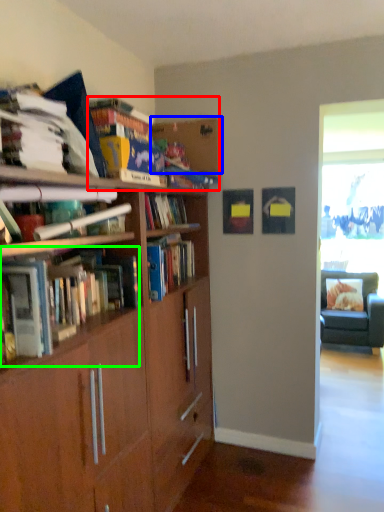
Question: Considering the real-world distances, which object is farthest from book (highlighted by a red box)? shelf (highlighted by a blue box) or book (highlighted by a green box)?

Choices:
 (A) shelf
 (B) book

Answer: (B)